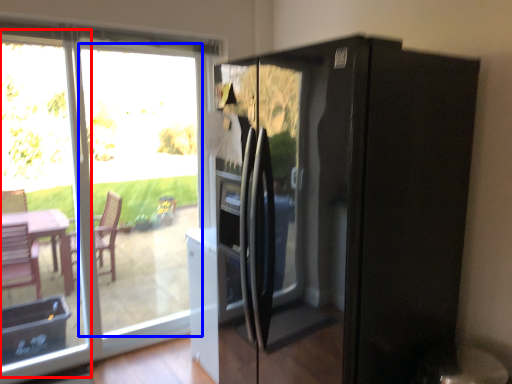
Question: Which object appears closest to the camera in this image, glass door (highlighted by a red box) or glass door (highlighted by a blue box)?

Choices:
 (A) glass door
 (B) glass door

Answer: (A)